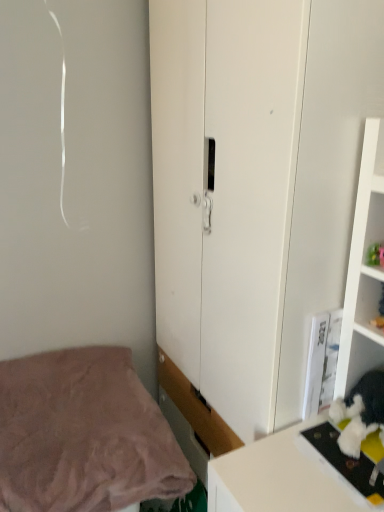
Question: Is white matte cupboard at center not inside pink soft fabric bed at lower left?

Choices:
 (A) yes
 (B) no

Answer: (A)

Question: Is white matte cupboard at center oriented away from pink soft fabric bed at lower left?

Choices:
 (A) no
 (B) yes

Answer: (B)

Question: Can you confirm if white matte cupboard at center is taller than pink soft fabric bed at lower left?

Choices:
 (A) no
 (B) yes

Answer: (B)

Question: Is white matte cupboard at center facing towards pink soft fabric bed at lower left?

Choices:
 (A) yes
 (B) no

Answer: (A)

Question: Is white matte cupboard at center wider than pink soft fabric bed at lower left?

Choices:
 (A) yes
 (B) no

Answer: (B)

Question: Considering the relative sizes of white matte cupboard at center and pink soft fabric bed at lower left in the image provided, is white matte cupboard at center shorter than pink soft fabric bed at lower left?

Choices:
 (A) no
 (B) yes

Answer: (A)

Question: From a real-world perspective, is pink soft fabric bed at lower left positioned over white matte cupboard at center based on gravity?

Choices:
 (A) yes
 (B) no

Answer: (B)

Question: Does pink soft fabric bed at lower left have a greater width compared to white matte cupboard at center?

Choices:
 (A) no
 (B) yes

Answer: (B)

Question: Does pink soft fabric bed at lower left come behind white matte cupboard at center?

Choices:
 (A) no
 (B) yes

Answer: (B)

Question: Does pink soft fabric bed at lower left appear on the right side of white matte cupboard at center?

Choices:
 (A) yes
 (B) no

Answer: (B)

Question: Does pink soft fabric bed at lower left have a greater height compared to white matte cupboard at center?

Choices:
 (A) no
 (B) yes

Answer: (A)

Question: Is pink soft fabric bed at lower left smaller than white matte cupboard at center?

Choices:
 (A) yes
 (B) no

Answer: (A)

Question: From the image's perspective, is white matte cupboard at center above or below pink soft fabric bed at lower left?

Choices:
 (A) above
 (B) below

Answer: (A)